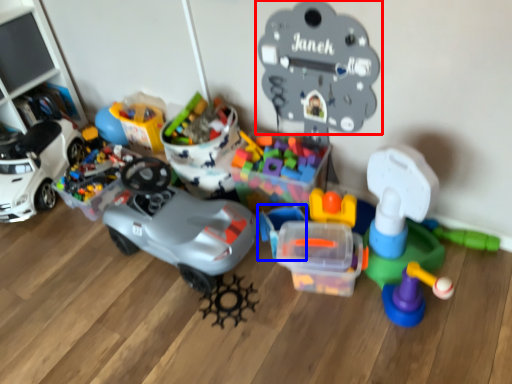
Question: Which object appears closest to the camera in this image, toy (highlighted by a red box) or toy (highlighted by a blue box)?

Choices:
 (A) toy
 (B) toy

Answer: (A)